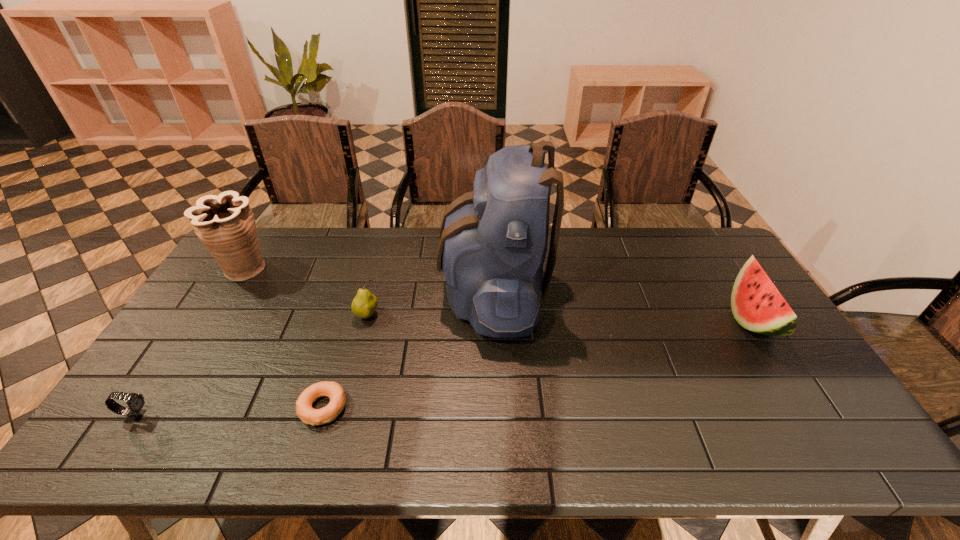
Locate an element on the screen. This screenshot has width=960, height=540. free space between the pear and the backpack is located at coordinates (430, 303).

You are a GUI agent. You are given a task and a screenshot of the screen. Output one action in this format:
    pyautogui.click(x=<x>, y=<y>)
    Task: Click on the object that stands as the third closest to the shortest object
    The width and height of the screenshot is (960, 540).
    Given the screenshot: What is the action you would take?
    pyautogui.click(x=135, y=402)

Where is `object that is the closest to the backpack`? The height and width of the screenshot is (540, 960). object that is the closest to the backpack is located at coordinates (365, 303).

I want to click on free space that satisfies the following two spatial constraints: 1. on the front side of the second tallest object; 2. on the left side of the bagel, so point(158,408).